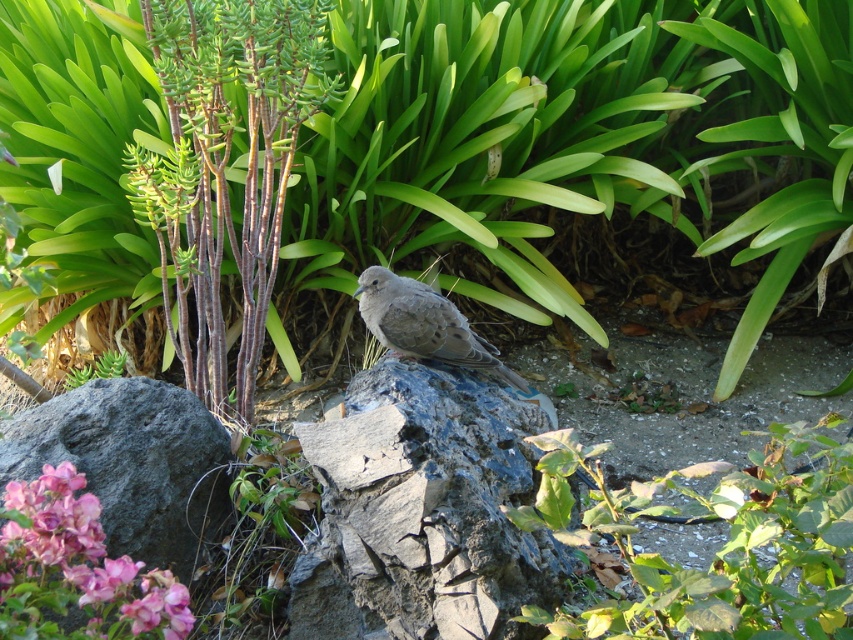
Question: Does pink matte petals at center appear on the right side of brown feathered bird at center?

Choices:
 (A) no
 (B) yes

Answer: (A)

Question: Does gray rough rock at center come behind brown feathered bird at center?

Choices:
 (A) no
 (B) yes

Answer: (A)

Question: Considering the real-world distances, which object is farthest from the gray rough rock at center?

Choices:
 (A) pink matte petals at center
 (B) green leafy plant at center

Answer: (A)

Question: Which object is the farthest from the brown feathered bird at center?

Choices:
 (A) pink matte petals at center
 (B) gray rough rock at center
 (C) green leafy plant at center

Answer: (A)

Question: Can you confirm if green leafy plant at center is thinner than brown feathered bird at center?

Choices:
 (A) no
 (B) yes

Answer: (A)

Question: Which point is closer to the camera?

Choices:
 (A) (381, 282)
 (B) (437, 460)
 (C) (67, 497)

Answer: (C)